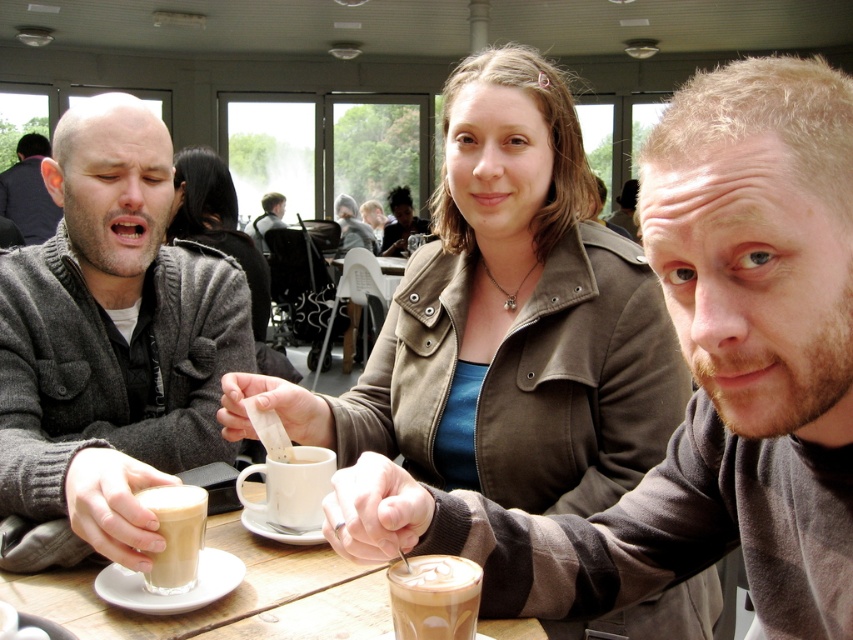
Question: Among these objects, which one is nearest to the camera?

Choices:
 (A) translucent glass cup at center
 (B) matte gray sweater at center

Answer: (B)

Question: Can you confirm if translucent glass cup at center is positioned to the left of latte art coffee at center?

Choices:
 (A) yes
 (B) no

Answer: (A)

Question: Where is latte foam at cup center located in relation to matte black jacket at left in the image?

Choices:
 (A) left
 (B) right

Answer: (B)

Question: Can you confirm if matte black jacket at left is wider than white frothy coffee at center?

Choices:
 (A) no
 (B) yes

Answer: (B)

Question: Estimate the real-world distances between objects in this image. Which object is farther from the smooth brown leather jacket at center?

Choices:
 (A) latte foam at cup center
 (B) matte brown jacket at center
 (C) matte gray sweater at left
 (D) matte gray sweater at center

Answer: (A)

Question: Considering the real-world distances, which object is farthest from the latte foam at cup center?

Choices:
 (A) white ceramic mug at center
 (B) translucent glass cup at center
 (C) white frothy coffee at center
 (D) latte art coffee at center

Answer: (D)